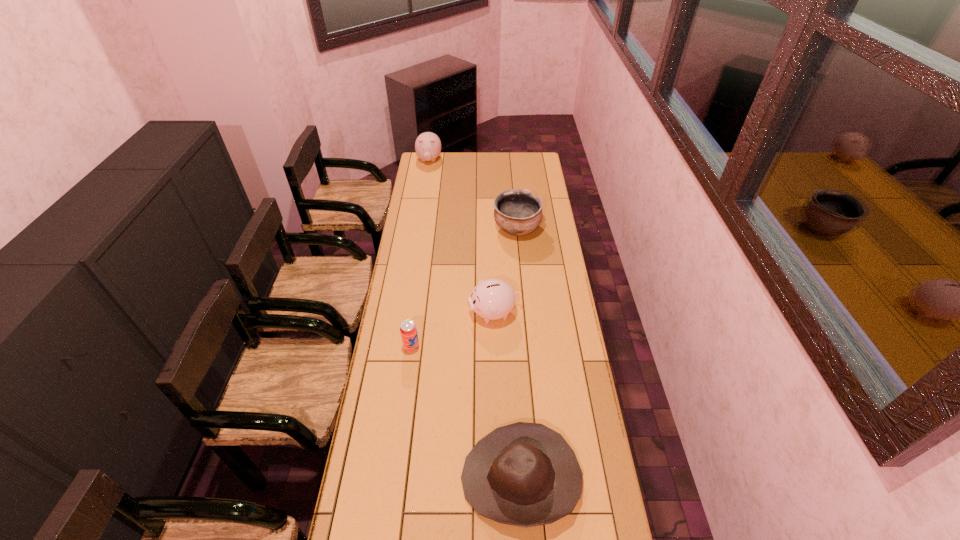
I want to click on vacant space that is in between the farther piggy bank and the nearest object, so click(475, 319).

Point out which object is positioned as the nearest to the third farthest object. Please provide its 2D coordinates. Your answer should be formatted as a tuple, i.e. [(x, y)], where the tuple contains the x and y coordinates of a point satisfying the conditions above.

[(408, 330)]

In order to click on object that is the second closest to the nearer piggy bank in this screenshot , I will do `click(517, 212)`.

The height and width of the screenshot is (540, 960). In order to click on vacant space that satisfies the following two spatial constraints: 1. at the snout of the farther piggy bank; 2. on the left side of the soda can in this screenshot , I will do `click(400, 348)`.

Locate an element on the screen. This screenshot has height=540, width=960. vacant region that satisfies the following two spatial constraints: 1. at the snout of the left piggy bank; 2. on the left side of the cowboy hat is located at coordinates (379, 478).

Where is `free region that satisfies the following two spatial constraints: 1. on the back side of the second nearest object; 2. on the left side of the pottery`? free region that satisfies the following two spatial constraints: 1. on the back side of the second nearest object; 2. on the left side of the pottery is located at coordinates (427, 229).

Locate an element on the screen. This screenshot has height=540, width=960. free location that satisfies the following two spatial constraints: 1. at the snout of the nearer piggy bank; 2. on the right side of the left piggy bank is located at coordinates (405, 313).

This screenshot has height=540, width=960. In order to click on vacant space that satisfies the following two spatial constraints: 1. at the snout of the cowboy hat; 2. on the right side of the farther piggy bank in this screenshot , I will do `click(379, 478)`.

Identify the location of free point that satisfies the following two spatial constraints: 1. at the snout of the farthest object; 2. on the right side of the fourth farthest object. (400, 348).

At what (x,y) coordinates should I click in order to perform the action: click on free location that satisfies the following two spatial constraints: 1. on the front side of the nearest object; 2. on the right side of the third nearest object. Please return your answer as a coordinate pair (x, y). Looking at the image, I should click on pos(498,478).